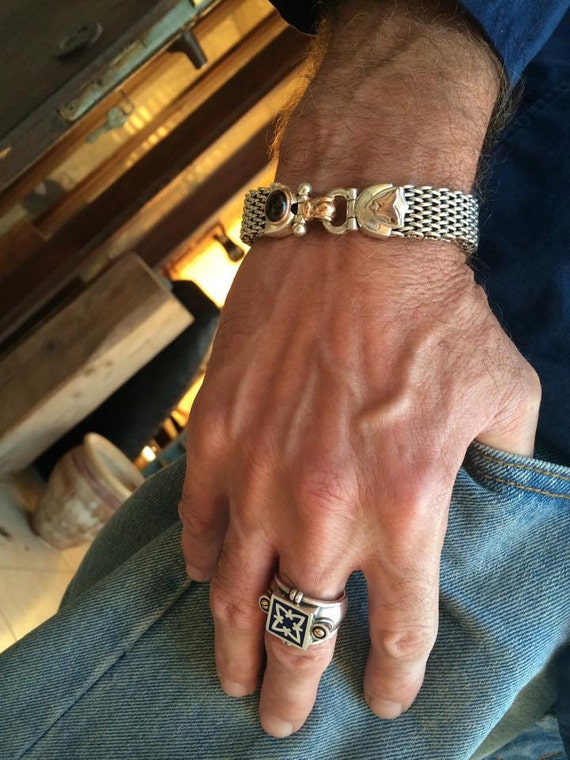
I want to click on pot, so click(x=55, y=499).